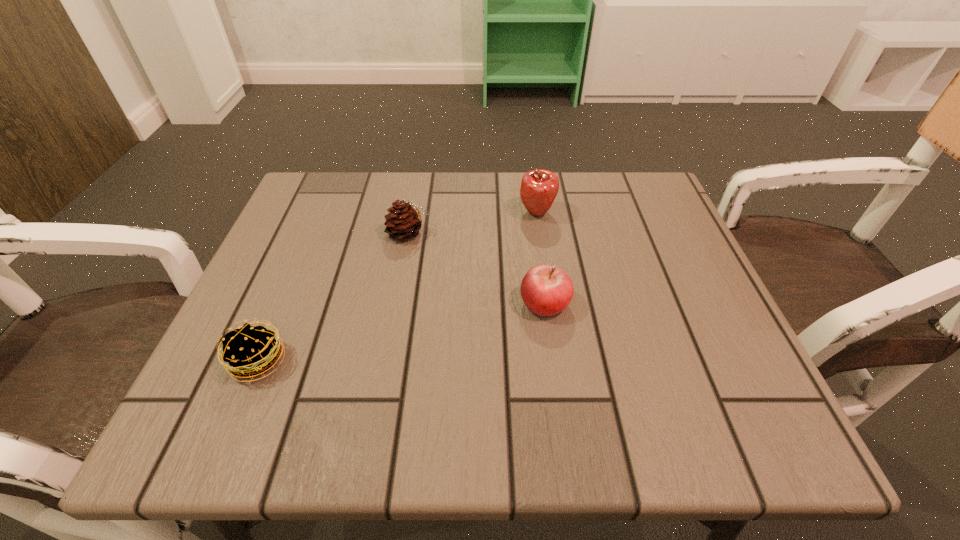
Where is `free space located 0.280m on the right of the leftmost object`? The image size is (960, 540). free space located 0.280m on the right of the leftmost object is located at coordinates (461, 361).

Locate an element on the screen. The image size is (960, 540). apple that is positioned at the far edge is located at coordinates (539, 188).

The image size is (960, 540). I want to click on pinecone situated at the far edge, so pyautogui.click(x=402, y=223).

The image size is (960, 540). Identify the location of object present at the left edge. (251, 350).

The image size is (960, 540). I want to click on blank space at the far edge of the desktop, so click(466, 183).

The height and width of the screenshot is (540, 960). In the image, there is a desktop. Find the location of `vacant space at the near edge`. vacant space at the near edge is located at coordinates (661, 433).

You are a GUI agent. You are given a task and a screenshot of the screen. Output one action in this format:
    pyautogui.click(x=<x>, y=<y>)
    Task: Click on the vacant space at the left edge of the desktop
    This screenshot has width=960, height=540.
    Given the screenshot: What is the action you would take?
    pyautogui.click(x=302, y=366)

The image size is (960, 540). In the image, there is a desktop. In order to click on vacant space at the right edge in this screenshot , I will do `click(692, 339)`.

You are a GUI agent. You are given a task and a screenshot of the screen. Output one action in this format:
    pyautogui.click(x=<x>, y=<y>)
    Task: Click on the free space at the far left corner of the desktop
    The width and height of the screenshot is (960, 540).
    Given the screenshot: What is the action you would take?
    pyautogui.click(x=353, y=209)

The width and height of the screenshot is (960, 540). In order to click on vacant point at the near left corner in this screenshot , I will do `click(189, 431)`.